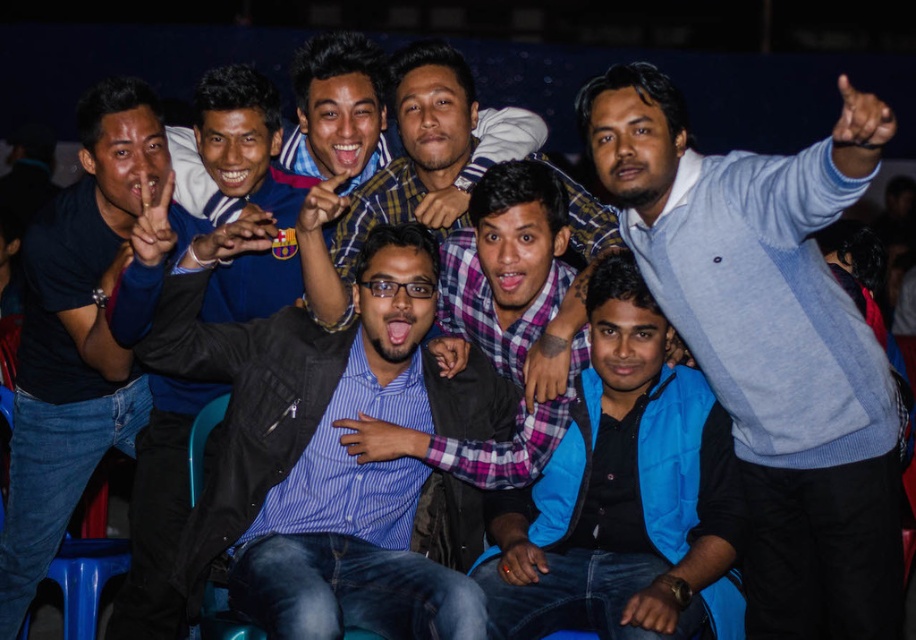
Question: Is blue striped shirt at center closer to camera compared to blue fleece jacket at center?

Choices:
 (A) yes
 (B) no

Answer: (A)

Question: Which object is the farthest from the dark blue shirt at left?

Choices:
 (A) blue striped shirt at center
 (B) light blue sweater at upper right

Answer: (B)

Question: Which of the following is the farthest from the observer?

Choices:
 (A) (123, 396)
 (B) (898, 573)
 (C) (240, 476)

Answer: (A)

Question: Estimate the real-world distances between objects in this image. Which object is farther from the blue plaid shirt at center?

Choices:
 (A) dark blue shirt at left
 (B) blue fleece jacket at center
 (C) blue striped shirt at center
 (D) light blue sweater at upper right

Answer: (D)

Question: Can you confirm if light blue sweater at upper right is positioned to the right of blue striped shirt at center?

Choices:
 (A) no
 (B) yes

Answer: (B)

Question: Is light blue sweater at upper right closer to the viewer compared to blue fleece jacket at center?

Choices:
 (A) no
 (B) yes

Answer: (B)